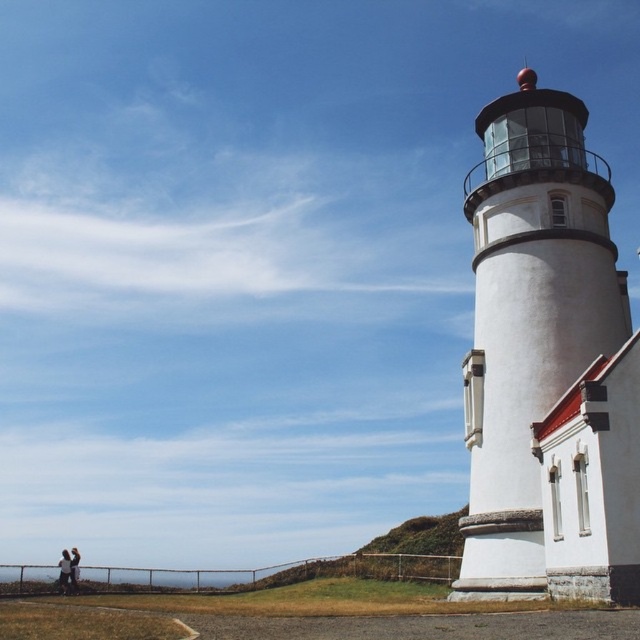
You are standing at the base of the white painted stone tower at right and want to greet the person wearing the white cotton shirt at lower left. Which direction should you walk to reach them?

The white painted stone tower at right is located above the white cotton shirt at lower left, so you should walk downward from the tower to reach the person.

You are a photographer planning to take a wide shot of the lighthouse and the couple. You want to ensure both the white painted stone tower at right and the light brown leather jacket at lower left are fully visible in the frame. Based on their sizes, which object should you focus on to ensure both are captured without cropping?

The white painted stone tower at right has a lesser width compared to light brown leather jacket at lower left. Therefore, focusing on the white painted stone tower at right ensures both objects will fit in the frame since it is narrower and requires less space.

You are standing at the base of the white painted stone tower at right and want to see the light brown leather jacket at lower left. Which direction should you turn to look towards the jacket?

The light brown leather jacket at lower left is located to the left side of the white painted stone tower at right, so you should turn to your left to look towards the jacket.